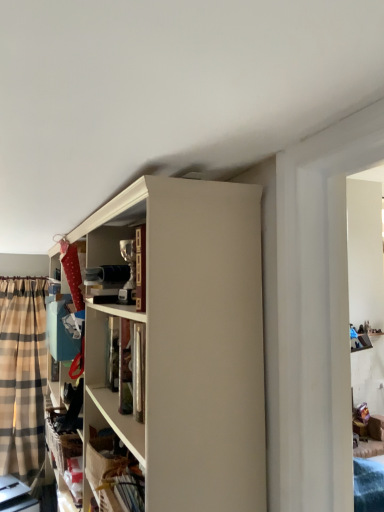
Measure the distance between plaid fabric curtain at left and camera.

plaid fabric curtain at left and camera are 3.07 meters apart.

At what (x,y) coordinates should I click in order to perform the action: click on plaid fabric curtain at left. Please return your answer as a coordinate pair (x, y). This screenshot has height=512, width=384. Looking at the image, I should click on point(22,376).

What do you see at coordinates (22, 376) in the screenshot? The image size is (384, 512). I see `plaid fabric curtain at left` at bounding box center [22, 376].

This screenshot has width=384, height=512. I want to click on metallic silver trophy at upper center, so click(x=115, y=250).

The height and width of the screenshot is (512, 384). What do you see at coordinates (115, 250) in the screenshot? I see `metallic silver trophy at upper center` at bounding box center [115, 250].

What is the approximate height of metallic silver trophy at upper center?

metallic silver trophy at upper center is 10.98 inches tall.

Where is `plaid fabric curtain at left`? The image size is (384, 512). plaid fabric curtain at left is located at coordinates (x=22, y=376).

Which is more to the left, plaid fabric curtain at left or metallic silver trophy at upper center?

From the viewer's perspective, plaid fabric curtain at left appears more on the left side.

Which object is closer to the camera, plaid fabric curtain at left or metallic silver trophy at upper center?

metallic silver trophy at upper center.

Is point (5, 473) closer to camera compared to point (92, 259)?

No, (5, 473) is further to viewer.

From the image's perspective, between plaid fabric curtain at left and metallic silver trophy at upper center, who is located below?

From the image's view, plaid fabric curtain at left is below.

From a real-world perspective, which object rests below the other?

plaid fabric curtain at left.

Looking at their sizes, would you say plaid fabric curtain at left is wider or thinner than metallic silver trophy at upper center?

plaid fabric curtain at left is wider than metallic silver trophy at upper center.

Is plaid fabric curtain at left shorter than metallic silver trophy at upper center?

No.

Considering the sizes of plaid fabric curtain at left and metallic silver trophy at upper center in the image, is plaid fabric curtain at left bigger or smaller than metallic silver trophy at upper center?

In the image, plaid fabric curtain at left appears to be larger than metallic silver trophy at upper center.

Is plaid fabric curtain at left outside of metallic silver trophy at upper center?

Yes, plaid fabric curtain at left is not within metallic silver trophy at upper center.

Are plaid fabric curtain at left and metallic silver trophy at upper center located far from each other?

Indeed, plaid fabric curtain at left is not near metallic silver trophy at upper center.

Is plaid fabric curtain at left turned away from metallic silver trophy at upper center?

No, plaid fabric curtain at left's orientation is not away from metallic silver trophy at upper center.

Can you tell me how much plaid fabric curtain at left and metallic silver trophy at upper center differ in facing direction?

96.5 degrees separate the facing orientations of plaid fabric curtain at left and metallic silver trophy at upper center.

Where is `curtain below the metallic silver trophy at upper center (from the image's perspective)`? The image size is (384, 512). curtain below the metallic silver trophy at upper center (from the image's perspective) is located at coordinates (22, 376).

Can you confirm if metallic silver trophy at upper center is positioned to the right of plaid fabric curtain at left?

Indeed, metallic silver trophy at upper center is positioned on the right side of plaid fabric curtain at left.

Between metallic silver trophy at upper center and plaid fabric curtain at left, which one is positioned behind?

plaid fabric curtain at left is behind.

Is point (95, 265) in front of point (14, 383)?

That is True.

From the image's perspective, relative to plaid fabric curtain at left, is metallic silver trophy at upper center above or below?

Clearly, from the image's perspective, metallic silver trophy at upper center is above plaid fabric curtain at left.

From a real-world perspective, is metallic silver trophy at upper center over plaid fabric curtain at left?

Indeed, from a real-world perspective, metallic silver trophy at upper center stands above plaid fabric curtain at left.

Considering the relative sizes of metallic silver trophy at upper center and plaid fabric curtain at left in the image provided, is metallic silver trophy at upper center thinner than plaid fabric curtain at left?

Correct, the width of metallic silver trophy at upper center is less than that of plaid fabric curtain at left.

Which of these two, metallic silver trophy at upper center or plaid fabric curtain at left, stands taller?

With more height is plaid fabric curtain at left.

Is metallic silver trophy at upper center bigger or smaller than plaid fabric curtain at left?

metallic silver trophy at upper center is smaller than plaid fabric curtain at left.

Is metallic silver trophy at upper center completely or partially outside of plaid fabric curtain at left?

Absolutely, metallic silver trophy at upper center is external to plaid fabric curtain at left.

Does metallic silver trophy at upper center touch plaid fabric curtain at left?

No, metallic silver trophy at upper center is not beside plaid fabric curtain at left.

Is metallic silver trophy at upper center turned away from plaid fabric curtain at left?

metallic silver trophy at upper center does not have its back to plaid fabric curtain at left.

Can you tell me how much metallic silver trophy at upper center and plaid fabric curtain at left differ in facing direction?

They differ by 96.5 degrees in their facing directions.

The width and height of the screenshot is (384, 512). In order to click on curtain behind the metallic silver trophy at upper center in this screenshot , I will do `click(22, 376)`.

Find the location of a particular element. The image size is (384, 512). cabinet that appears above the plaid fabric curtain at left (from the image's perspective) is located at coordinates (115, 250).

Locate an element on the screen. The image size is (384, 512). cabinet above the plaid fabric curtain at left (from a real-world perspective) is located at coordinates (115, 250).